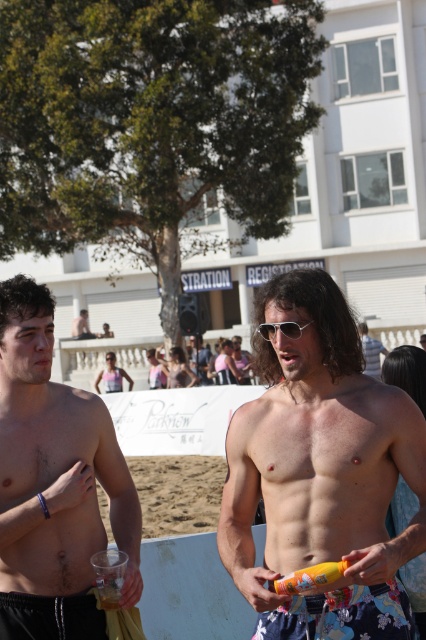
Question: Which is nearer to the shiny silver phone at right?

Choices:
 (A) smooth skin torso at left
 (B) yellow matte can at center

Answer: (A)

Question: Can you confirm if smooth skin torso at left is wider than shiny silver phone at center?

Choices:
 (A) no
 (B) yes

Answer: (A)

Question: Does smooth skin torso at left appear under black matte shorts at lower left?

Choices:
 (A) yes
 (B) no

Answer: (B)

Question: Which object is farther from the camera taking this photo?

Choices:
 (A) silver reflective sunglasses at center
 (B) yellow matte can at center

Answer: (A)

Question: Estimate the real-world distances between objects in this image. Which object is closer to the smooth tan skin at center?

Choices:
 (A) silver reflective sunglasses at center
 (B) floral fabric shorts at lower center
 (C) shiny silver phone at right
 (D) shiny silver phone at center

Answer: (B)

Question: Can you confirm if smooth tan skin at center is positioned below yellow matte can at center?

Choices:
 (A) yes
 (B) no

Answer: (B)